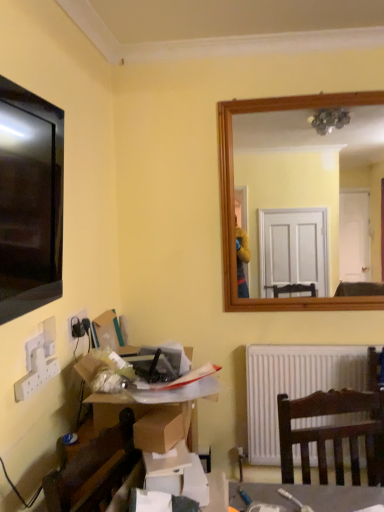
Question: Can you confirm if white matte radiator at lower center is smaller than black plastic socket at lower left?

Choices:
 (A) no
 (B) yes

Answer: (A)

Question: Considering the relative positions of white matte radiator at lower center and black plastic socket at lower left in the image provided, is white matte radiator at lower center behind black plastic socket at lower left?

Choices:
 (A) yes
 (B) no

Answer: (A)

Question: Does white matte radiator at lower center appear on the left side of black plastic socket at lower left?

Choices:
 (A) yes
 (B) no

Answer: (B)

Question: Does white matte radiator at lower center have a greater height compared to black plastic socket at lower left?

Choices:
 (A) yes
 (B) no

Answer: (A)

Question: Is white matte radiator at lower center aimed at black plastic socket at lower left?

Choices:
 (A) no
 (B) yes

Answer: (A)

Question: Considering the positions of point (342, 418) and point (72, 322), is point (342, 418) closer or farther from the camera than point (72, 322)?

Choices:
 (A) closer
 (B) farther

Answer: (A)

Question: Is white matte radiator at lower center inside or outside of black plastic socket at lower left?

Choices:
 (A) inside
 (B) outside

Answer: (B)

Question: In terms of height, does white matte radiator at lower center look taller or shorter compared to black plastic socket at lower left?

Choices:
 (A) short
 (B) tall

Answer: (B)

Question: From a real-world perspective, relative to black plastic socket at lower left, is white matte radiator at lower center vertically above or below?

Choices:
 (A) below
 (B) above

Answer: (A)

Question: In terms of size, does white matte radiator at lower center appear bigger or smaller than cardboard box at lower left?

Choices:
 (A) small
 (B) big

Answer: (A)

Question: Do you think white matte radiator at lower center is within cardboard box at lower left, or outside of it?

Choices:
 (A) outside
 (B) inside

Answer: (A)

Question: In terms of height, does white matte radiator at lower center look taller or shorter compared to cardboard box at lower left?

Choices:
 (A) short
 (B) tall

Answer: (B)

Question: In the image, is white matte radiator at lower center on the left side or the right side of cardboard box at lower left?

Choices:
 (A) left
 (B) right

Answer: (B)

Question: In terms of size, does cardboard box at lower left appear bigger or smaller than white matte radiator at lower center?

Choices:
 (A) big
 (B) small

Answer: (A)

Question: Is cardboard box at lower left to the left or to the right of white matte radiator at lower center in the image?

Choices:
 (A) right
 (B) left

Answer: (B)